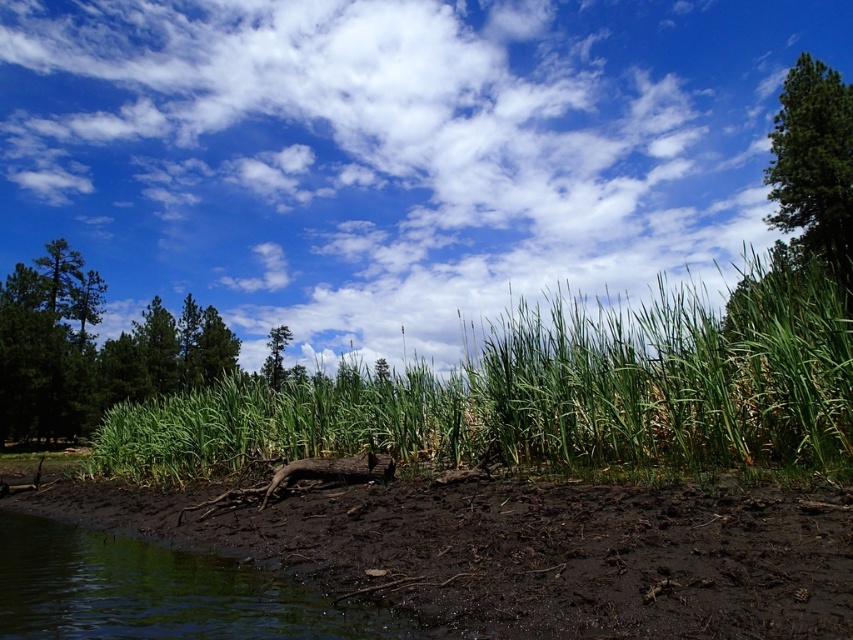
You are standing on the muddy shoreline near the dark ground and want to take a photo of the white fluffy cloud at upper center. If your camera has a maximum zoom range of 100 feet, will you need to move closer to the cloud to capture it clearly?

The white fluffy cloud at upper center is 145.83 feet away from the viewer. Since the camera can only zoom up to 100 feet, you need to move closer to the cloud to capture it clearly.

Based on the scene, which tree is positioned to the right side of the other between the green leafy tree at upper right and the green matte tree at center?

The green leafy tree at upper right is positioned to the right of the green matte tree at center.

In the scene shown: You are a hiker trying to cross the muddy area near the water. You see the green grass at center and the green matte tree at upper left. Which direction should you walk to reach the tree without getting too muddy?

You should walk towards the green matte tree at upper left from the green grass at center since they are 18.59 meters apart, but the exact muddy area details aren